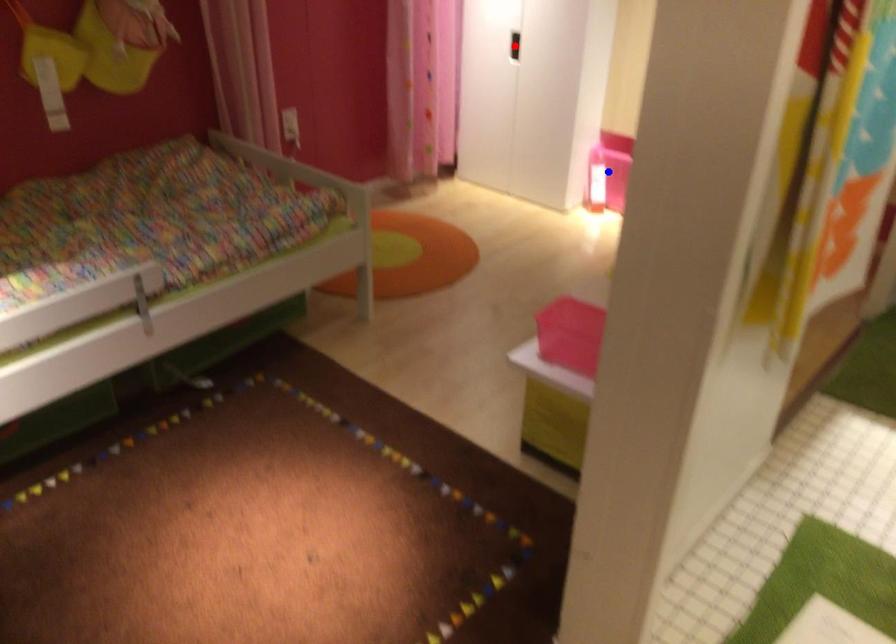
Question: Two points are marked on the image. Which point is closer to the camera?

Choices:
 (A) Blue point is closer.
 (B) Red point is closer.

Answer: (A)